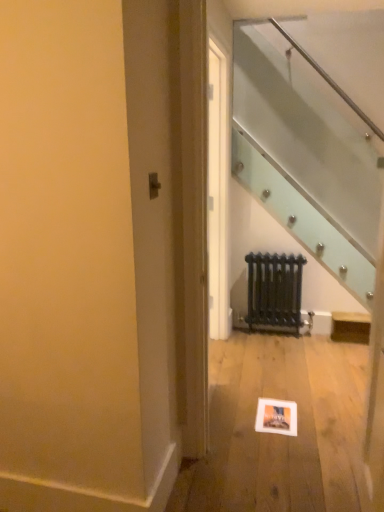
You are a GUI agent. You are given a task and a screenshot of the screen. Output one action in this format:
    pyautogui.click(x=<x>, y=<y>)
    Task: Click on the black metal radiator at center
    
    Given the screenshot: What is the action you would take?
    pyautogui.click(x=274, y=290)

What do you see at coordinates (274, 290) in the screenshot?
I see `black metal radiator at center` at bounding box center [274, 290].

Find the location of a particular element. The height and width of the screenshot is (512, 384). matte orange picture frame at lower center is located at coordinates (276, 417).

The image size is (384, 512). What do you see at coordinates (276, 417) in the screenshot? I see `matte orange picture frame at lower center` at bounding box center [276, 417].

What are the coordinates of `black metal radiator at center` in the screenshot? It's located at (274, 290).

Can you confirm if black metal radiator at center is positioned to the right of matte orange picture frame at lower center?

Correct, you'll find black metal radiator at center to the right of matte orange picture frame at lower center.

Is black metal radiator at center further to camera compared to matte orange picture frame at lower center?

Yes, the depth of black metal radiator at center is greater than that of matte orange picture frame at lower center.

Which is behind, point (265, 311) or point (277, 404)?

Point (265, 311)

From the image's perspective, which one is positioned lower, black metal radiator at center or matte orange picture frame at lower center?

matte orange picture frame at lower center appears lower in the image.

From a real-world perspective, is black metal radiator at center positioned over matte orange picture frame at lower center based on gravity?

Yes, from a real-world perspective, black metal radiator at center is over matte orange picture frame at lower center

Which object is wider, black metal radiator at center or matte orange picture frame at lower center?

With larger width is matte orange picture frame at lower center.

Looking at this image, is black metal radiator at center taller or shorter than matte orange picture frame at lower center?

black metal radiator at center is taller than matte orange picture frame at lower center.

Is black metal radiator at center bigger than matte orange picture frame at lower center?

Yes.

Would you say black metal radiator at center contains matte orange picture frame at lower center?

No, matte orange picture frame at lower center is not surrounded by black metal radiator at center.

Is black metal radiator at center next to matte orange picture frame at lower center?

No, black metal radiator at center is not touching matte orange picture frame at lower center.

Is matte orange picture frame at lower center at the back of black metal radiator at center?

No, black metal radiator at center's orientation is not away from matte orange picture frame at lower center.

The width and height of the screenshot is (384, 512). Find the location of `radiator to the right of matte orange picture frame at lower center`. radiator to the right of matte orange picture frame at lower center is located at coordinates (274, 290).

Would you say matte orange picture frame at lower center is to the left or to the right of black metal radiator at center in the picture?

matte orange picture frame at lower center is to the left of black metal radiator at center.

Relative to black metal radiator at center, is matte orange picture frame at lower center in front or behind?

Visually, matte orange picture frame at lower center is located in front of black metal radiator at center.

Which is closer to the camera, (294, 406) or (288, 302)?

Point (294, 406).

From the image's perspective, does matte orange picture frame at lower center appear lower than black metal radiator at center?

Correct, matte orange picture frame at lower center appears lower than black metal radiator at center in the image.

From a real-world perspective, is matte orange picture frame at lower center positioned over black metal radiator at center based on gravity?

Incorrect, from a real-world perspective, matte orange picture frame at lower center is lower than black metal radiator at center.

In the scene shown: Which object is thinner, matte orange picture frame at lower center or black metal radiator at center?

With smaller width is black metal radiator at center.

Considering the relative sizes of matte orange picture frame at lower center and black metal radiator at center in the image provided, is matte orange picture frame at lower center taller than black metal radiator at center?

No, matte orange picture frame at lower center is not taller than black metal radiator at center.

Considering the sizes of matte orange picture frame at lower center and black metal radiator at center in the image, is matte orange picture frame at lower center bigger or smaller than black metal radiator at center?

matte orange picture frame at lower center is smaller than black metal radiator at center.

In the scene shown: Is matte orange picture frame at lower center situated inside black metal radiator at center or outside?

The correct answer is: outside.

Is matte orange picture frame at lower center with black metal radiator at center?

No, matte orange picture frame at lower center is not beside black metal radiator at center.

Is matte orange picture frame at lower center looking in the opposite direction of black metal radiator at center?

No, black metal radiator at center is not at the back of matte orange picture frame at lower center.

Measure the distance between matte orange picture frame at lower center and black metal radiator at center.

matte orange picture frame at lower center and black metal radiator at center are 1.11 meters apart.

You are a GUI agent. You are given a task and a screenshot of the screen. Output one action in this format:
    pyautogui.click(x=<x>, y=<y>)
    Task: Click on the picture frame below the black metal radiator at center (from a real-world perspective)
    This screenshot has width=384, height=512.
    Given the screenshot: What is the action you would take?
    pyautogui.click(x=276, y=417)

The width and height of the screenshot is (384, 512). I want to click on radiator above the matte orange picture frame at lower center (from a real-world perspective), so click(x=274, y=290).

The width and height of the screenshot is (384, 512). I want to click on picture frame in front of the black metal radiator at center, so click(x=276, y=417).